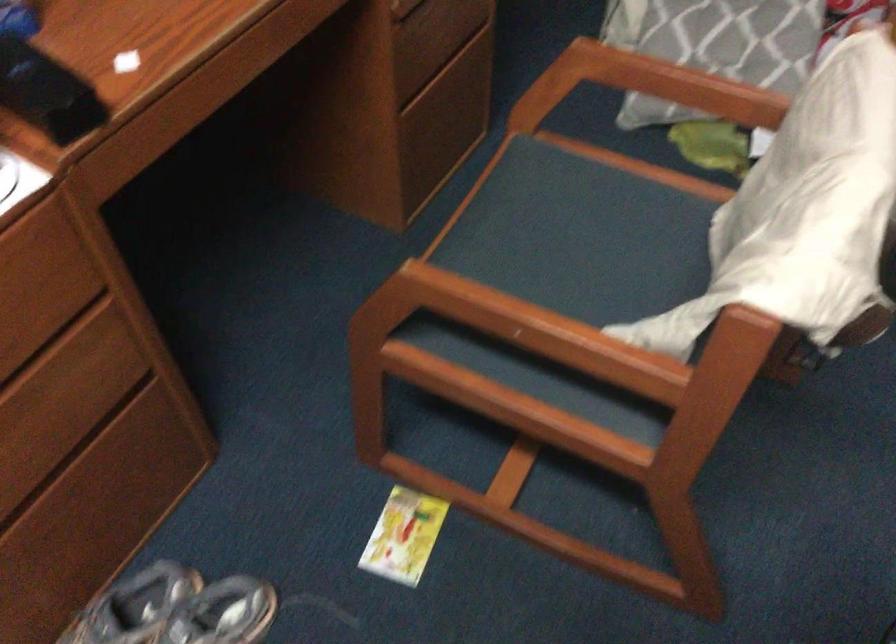
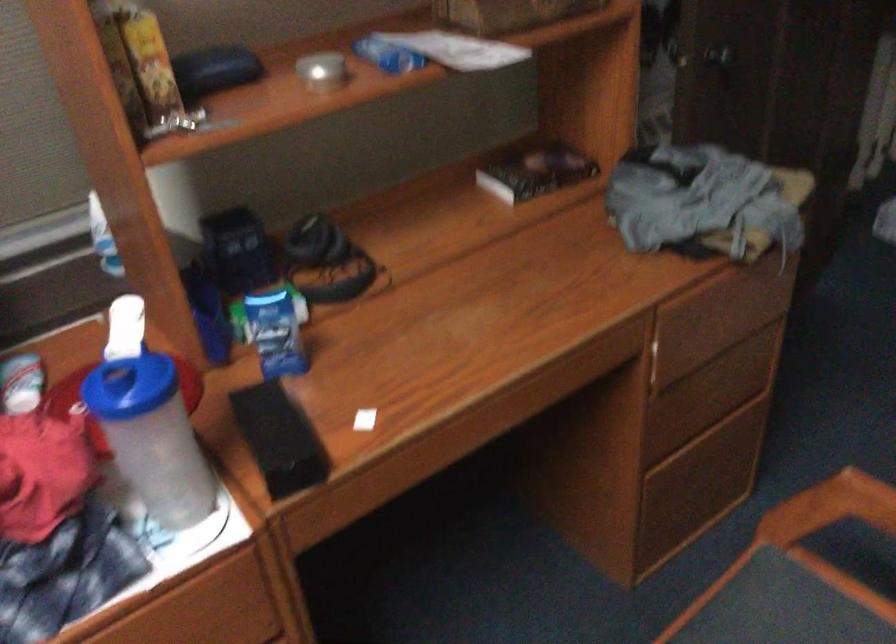
Question: The camera is either moving clockwise (left) or counter-clockwise (right) around the object. The first image is from the beginning of the video and the second image is from the end. Is the camera moving left or right when shooting the video?

Choices:
 (A) Left
 (B) Right

Answer: (B)